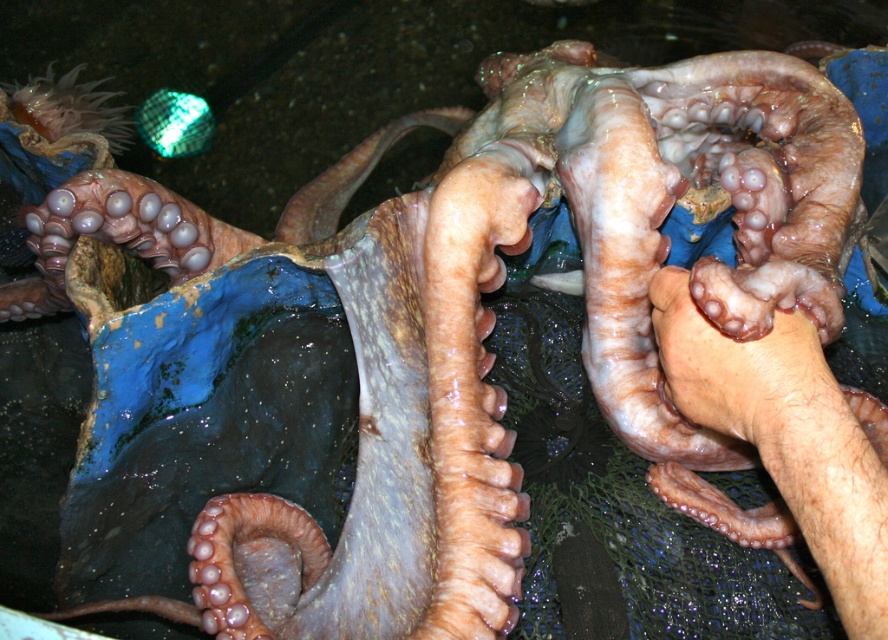
Question: Does smooth skin hand at center come behind pinkish flesh at center?

Choices:
 (A) yes
 (B) no

Answer: (B)

Question: Is smooth skin hand at center to the left of pinkish flesh at center from the viewer's perspective?

Choices:
 (A) yes
 (B) no

Answer: (B)

Question: Among these objects, which one is nearest to the camera?

Choices:
 (A) smooth skin hand at center
 (B) pinkish flesh at center

Answer: (A)

Question: Is smooth skin hand at center wider than pinkish flesh at center?

Choices:
 (A) no
 (B) yes

Answer: (B)

Question: Among these points, which one is nearest to the camera?

Choices:
 (A) (791, 304)
 (B) (765, 349)

Answer: (B)